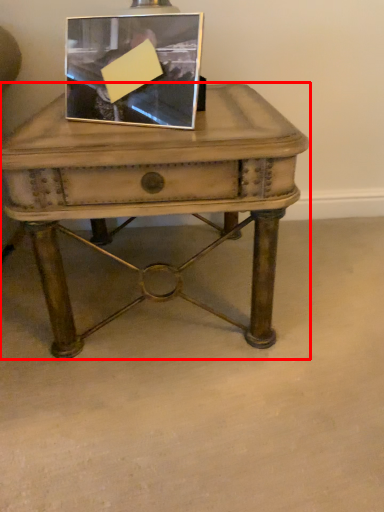
Question: In this image, where is table (annotated by the red box) located relative to picture frame?

Choices:
 (A) left
 (B) right

Answer: (B)